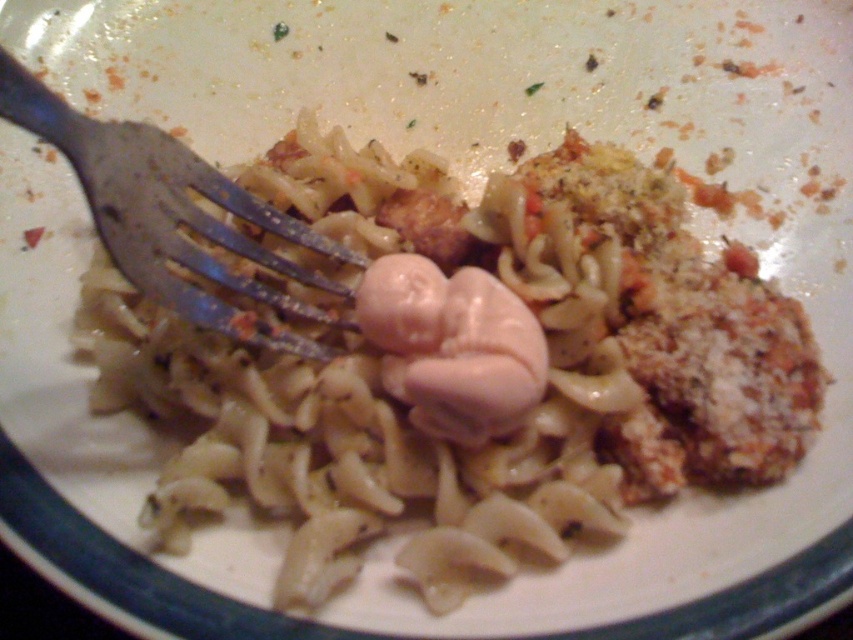
Question: Can you confirm if metallic silver fork at left is wider than brown crispy meat at center?

Choices:
 (A) yes
 (B) no

Answer: (A)

Question: Estimate the real-world distances between objects in this image. Which object is closer to the pink matte meat at center?

Choices:
 (A) metallic silver fork at left
 (B) brown crispy meat at center

Answer: (B)

Question: Observing the image, what is the correct spatial positioning of metallic silver fork at left in reference to pink matte meat at center?

Choices:
 (A) right
 (B) left

Answer: (B)

Question: Which point is farther from the camera taking this photo?

Choices:
 (A) (212, 200)
 (B) (532, 353)
 (C) (416, 220)

Answer: (C)

Question: Which point is farther to the camera?

Choices:
 (A) (433, 410)
 (B) (409, 202)
 (C) (183, 212)

Answer: (B)

Question: Can you confirm if metallic silver fork at left is smaller than brown crispy meat at center?

Choices:
 (A) yes
 (B) no

Answer: (B)